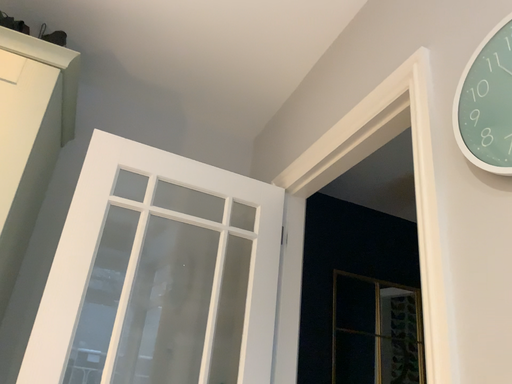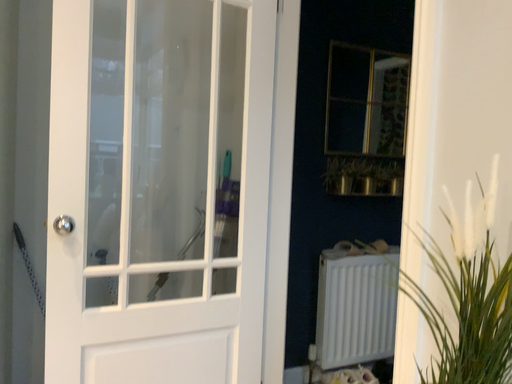
Question: Which way did the camera rotate in the video?

Choices:
 (A) rotated upward
 (B) rotated downward

Answer: (B)